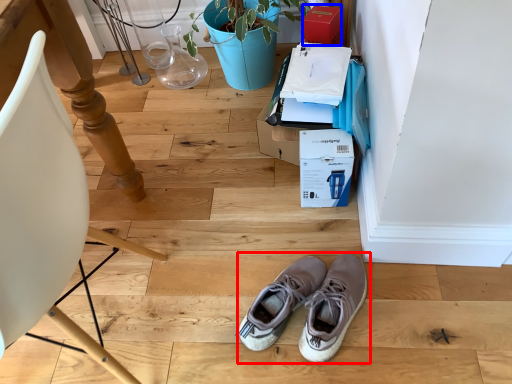
Question: Which point is further to the camera, footwear (highlighted by a red box) or cardboard box (highlighted by a blue box)?

Choices:
 (A) footwear
 (B) cardboard box

Answer: (B)